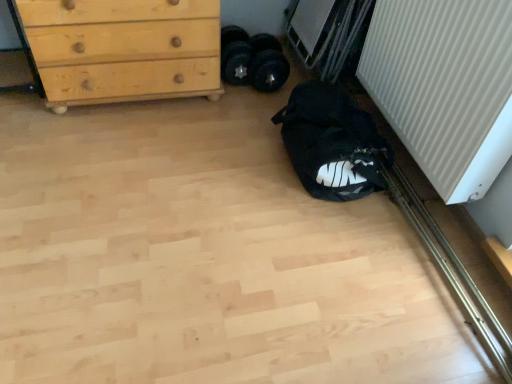
Where is `vacant space in between light wood/texture chest of drawers at upper left and black fabric bag at lower right`? vacant space in between light wood/texture chest of drawers at upper left and black fabric bag at lower right is located at coordinates (201, 135).